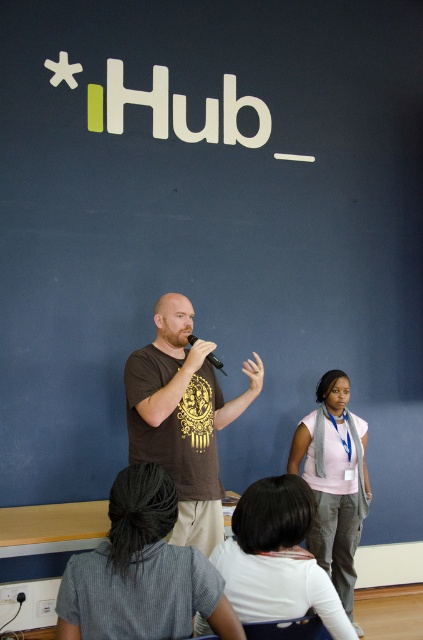
Question: From the image, what is the correct spatial relationship of brown cotton t-shirt at center in relation to black matte microphone at center?

Choices:
 (A) above
 (B) below

Answer: (B)

Question: Which object appears closest to the camera in this image?

Choices:
 (A) pink fabric shirt at center
 (B) gray fabric shirt at lower center
 (C) black matte microphone at center
 (D) brown cotton t-shirt at center

Answer: (B)

Question: Which is farther from the white matte shirt at lower center?

Choices:
 (A) pink fabric shirt at center
 (B) black matte microphone at center
 (C) gray fabric shirt at lower center

Answer: (A)

Question: Is gray fabric shirt at lower center thinner than brown cotton t-shirt at center?

Choices:
 (A) yes
 (B) no

Answer: (A)

Question: Does gray fabric shirt at lower center have a smaller size compared to black matte microphone at center?

Choices:
 (A) yes
 (B) no

Answer: (B)

Question: Which of these objects is positioned closest to the black matte microphone at center?

Choices:
 (A) white matte shirt at lower center
 (B) brown cotton t-shirt at center
 (C) gray fabric shirt at lower center
 (D) pink fabric shirt at center

Answer: (B)